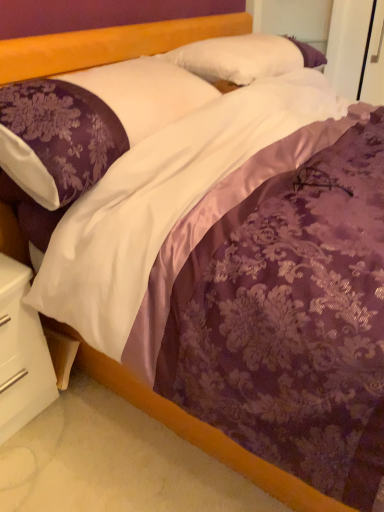
At what (x,y) coordinates should I click in order to perform the action: click on white glossy nightstand at lower left. Please return your answer as a coordinate pair (x, y). The image size is (384, 512). Looking at the image, I should click on (21, 353).

This screenshot has height=512, width=384. What do you see at coordinates (244, 57) in the screenshot?
I see `white satin pillow at upper center, marked as the second pillow in a front-to-back arrangement` at bounding box center [244, 57].

How much space does white satin pillow at upper center, marked as the second pillow in a front-to-back arrangement, occupy vertically?

white satin pillow at upper center, marked as the second pillow in a front-to-back arrangement, is 23.87 centimeters in height.

Describe the element at coordinates (88, 123) in the screenshot. I see `purple satin pillow at upper left, which is the 2th pillow from back to front` at that location.

Locate an element on the screen. The image size is (384, 512). purple satin pillow at upper left, which is the 2th pillow from back to front is located at coordinates (88, 123).

I want to click on white glossy nightstand at lower left, so click(x=21, y=353).

Between purple satin pillow at upper left, positioned as the 1th pillow in front-to-back order, and white glossy nightstand at lower left, which one has smaller width?

With smaller width is white glossy nightstand at lower left.

Considering the points (104, 126) and (16, 379), which point is behind, point (104, 126) or point (16, 379)?

The point (16, 379) is behind.

Is purple satin pillow at upper left, positioned as the 1th pillow in front-to-back order, taller than white glossy nightstand at lower left?

No, purple satin pillow at upper left, positioned as the 1th pillow in front-to-back order, is not taller than white glossy nightstand at lower left.

From the picture: How far apart are purple satin pillow at upper left, which is the 2th pillow from back to front, and white glossy nightstand at lower left?

18.30 inches.

From a real-world perspective, is white satin pillow at upper center, marked as the first pillow in a back-to-front arrangement, positioned over white glossy nightstand at lower left based on gravity?

Yes, from a real-world perspective, white satin pillow at upper center, marked as the first pillow in a back-to-front arrangement, is above white glossy nightstand at lower left.

Consider the image. Considering the relative positions of white satin pillow at upper center, marked as the first pillow in a back-to-front arrangement, and white glossy nightstand at lower left in the image provided, is white satin pillow at upper center, marked as the first pillow in a back-to-front arrangement, to the left or to the right of white glossy nightstand at lower left?

white satin pillow at upper center, marked as the first pillow in a back-to-front arrangement, is to the right of white glossy nightstand at lower left.

Can you tell me how much white satin pillow at upper center, marked as the second pillow in a front-to-back arrangement, and white glossy nightstand at lower left differ in facing direction?

2.51 degrees separate the facing orientations of white satin pillow at upper center, marked as the second pillow in a front-to-back arrangement, and white glossy nightstand at lower left.

Considering the relative positions of white glossy nightstand at lower left and white satin pillow at upper center, marked as the first pillow in a back-to-front arrangement, in the image provided, is white glossy nightstand at lower left to the left of white satin pillow at upper center, marked as the first pillow in a back-to-front arrangement, from the viewer's perspective?

Yes, white glossy nightstand at lower left is to the left of white satin pillow at upper center, marked as the first pillow in a back-to-front arrangement.

From a real-world perspective, between white glossy nightstand at lower left and white satin pillow at upper center, marked as the first pillow in a back-to-front arrangement, who is vertically lower?

From a 3D spatial view, white glossy nightstand at lower left is below.

Looking at this image, is white glossy nightstand at lower left positioned before white satin pillow at upper center, marked as the second pillow in a front-to-back arrangement?

Yes, the depth of white glossy nightstand at lower left is less than that of white satin pillow at upper center, marked as the second pillow in a front-to-back arrangement.

Considering the positions of points (45, 393) and (268, 35), is point (45, 393) farther from camera compared to point (268, 35)?

No, (45, 393) is in front of (268, 35).

Locate an element on the screen. This screenshot has width=384, height=512. pillow above the purple satin pillow at upper left, which is the 2th pillow from back to front (from a real-world perspective) is located at coordinates (244, 57).

From the image's perspective, is purple satin pillow at upper left, positioned as the 1th pillow in front-to-back order, above white satin pillow at upper center, marked as the second pillow in a front-to-back arrangement?

No, from the image's perspective, purple satin pillow at upper left, positioned as the 1th pillow in front-to-back order, is not over white satin pillow at upper center, marked as the second pillow in a front-to-back arrangement.

Is purple satin pillow at upper left, positioned as the 1th pillow in front-to-back order, not within white satin pillow at upper center, marked as the first pillow in a back-to-front arrangement?

Yes.

In the scene shown: Does white satin pillow at upper center, marked as the first pillow in a back-to-front arrangement, touch purple satin pillow at upper left, which is the 2th pillow from back to front?

white satin pillow at upper center, marked as the first pillow in a back-to-front arrangement, and purple satin pillow at upper left, which is the 2th pillow from back to front, are clearly separated.

Is purple satin pillow at upper left, positioned as the 1th pillow in front-to-back order, located within white satin pillow at upper center, marked as the first pillow in a back-to-front arrangement?

No, purple satin pillow at upper left, positioned as the 1th pillow in front-to-back order, is located outside of white satin pillow at upper center, marked as the first pillow in a back-to-front arrangement.

From the image's perspective, is white satin pillow at upper center, marked as the second pillow in a front-to-back arrangement, above or below purple satin pillow at upper left, positioned as the 1th pillow in front-to-back order?

white satin pillow at upper center, marked as the second pillow in a front-to-back arrangement, is above purple satin pillow at upper left, positioned as the 1th pillow in front-to-back order.

Considering the sizes of white glossy nightstand at lower left and purple satin pillow at upper left, which is the 2th pillow from back to front, in the image, is white glossy nightstand at lower left bigger or smaller than purple satin pillow at upper left, which is the 2th pillow from back to front,?

Considering their sizes, white glossy nightstand at lower left takes up less space than purple satin pillow at upper left, which is the 2th pillow from back to front.

Can you confirm if white glossy nightstand at lower left is shorter than purple satin pillow at upper left, positioned as the 1th pillow in front-to-back order?

No.

Is white glossy nightstand at lower left beside purple satin pillow at upper left, which is the 2th pillow from back to front?

white glossy nightstand at lower left and purple satin pillow at upper left, which is the 2th pillow from back to front, are not in contact.

Does white glossy nightstand at lower left lie behind purple satin pillow at upper left, positioned as the 1th pillow in front-to-back order?

That is True.

At what (x,y) coordinates should I click in order to perform the action: click on nightstand below the purple satin pillow at upper left, positioned as the 1th pillow in front-to-back order (from the image's perspective). Please return your answer as a coordinate pair (x, y). The height and width of the screenshot is (512, 384). Looking at the image, I should click on (21, 353).

In the image, there is a white satin pillow at upper center, marked as the second pillow in a front-to-back arrangement. What are the coordinates of `nightstand below it (from a real-world perspective)` in the screenshot? It's located at (21, 353).

Which object lies nearer to the anchor point white satin pillow at upper center, marked as the second pillow in a front-to-back arrangement, white glossy nightstand at lower left or purple satin pillow at upper left, which is the 2th pillow from back to front?

Among the two, purple satin pillow at upper left, which is the 2th pillow from back to front, is located nearer to white satin pillow at upper center, marked as the second pillow in a front-to-back arrangement.

Looking at the image, which one is located further to purple satin pillow at upper left, which is the 2th pillow from back to front, white glossy nightstand at lower left or white satin pillow at upper center, marked as the second pillow in a front-to-back arrangement?

white glossy nightstand at lower left.

Considering their positions, is white satin pillow at upper center, marked as the second pillow in a front-to-back arrangement, positioned closer to white glossy nightstand at lower left than purple satin pillow at upper left, which is the 2th pillow from back to front?

The object closer to white glossy nightstand at lower left is purple satin pillow at upper left, which is the 2th pillow from back to front.

Looking at this image, when comparing their distances from white satin pillow at upper center, marked as the first pillow in a back-to-front arrangement, does purple satin pillow at upper left, which is the 2th pillow from back to front, or white glossy nightstand at lower left seem further?

The object further to white satin pillow at upper center, marked as the first pillow in a back-to-front arrangement, is white glossy nightstand at lower left.

When comparing their distances from white glossy nightstand at lower left, does purple satin pillow at upper left, positioned as the 1th pillow in front-to-back order, or white satin pillow at upper center, marked as the first pillow in a back-to-front arrangement, seem closer?

purple satin pillow at upper left, positioned as the 1th pillow in front-to-back order, is closer to white glossy nightstand at lower left.

Estimate the real-world distances between objects in this image. Which object is further from purple satin pillow at upper left, which is the 2th pillow from back to front, white satin pillow at upper center, marked as the second pillow in a front-to-back arrangement, or white glossy nightstand at lower left?

white glossy nightstand at lower left lies further to purple satin pillow at upper left, which is the 2th pillow from back to front, than the other object.

The width and height of the screenshot is (384, 512). What are the coordinates of `pillow between white satin pillow at upper center, marked as the second pillow in a front-to-back arrangement, and white glossy nightstand at lower left vertically` in the screenshot? It's located at (88, 123).